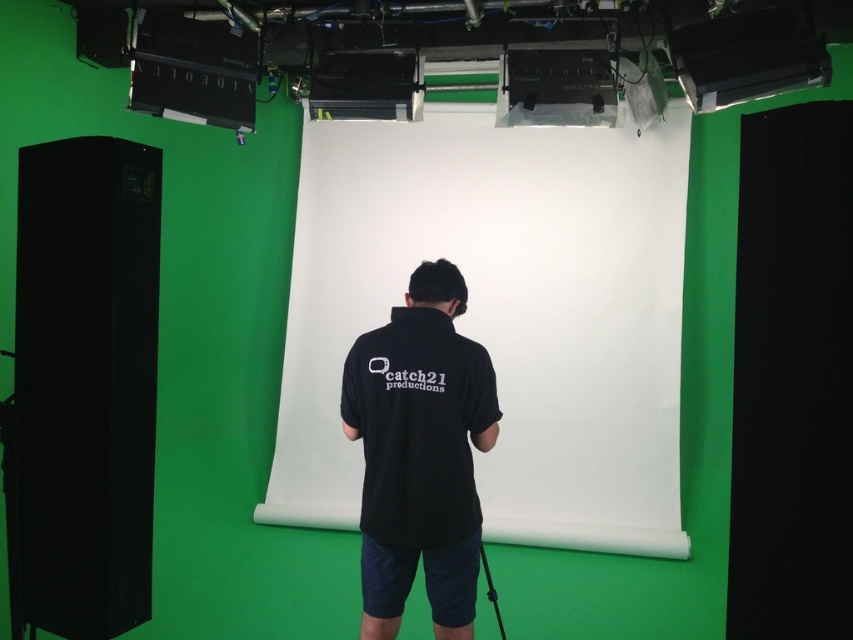
Question: Does white matte projection screen at center have a lesser width compared to black cotton shirt at center?

Choices:
 (A) yes
 (B) no

Answer: (B)

Question: Which object is farther from the camera taking this photo?

Choices:
 (A) black cotton shirt at center
 (B) white matte projection screen at center

Answer: (B)

Question: Does white matte projection screen at center appear under black cotton shirt at center?

Choices:
 (A) yes
 (B) no

Answer: (B)

Question: Is white matte projection screen at center above black cotton shirt at center?

Choices:
 (A) no
 (B) yes

Answer: (B)

Question: Which of the following is the closest to the observer?

Choices:
 (A) black cotton shirt at center
 (B) white matte projection screen at center

Answer: (A)